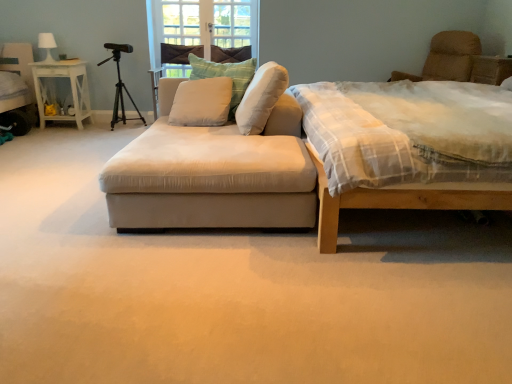
Question: Is white painted wood nightstand at left taller than beige fabric swivel chair at upper right?

Choices:
 (A) yes
 (B) no

Answer: (A)

Question: Can you confirm if white painted wood nightstand at left is bigger than beige fabric swivel chair at upper right?

Choices:
 (A) no
 (B) yes

Answer: (A)

Question: Considering the relative positions of white painted wood nightstand at left and beige fabric swivel chair at upper right in the image provided, is white painted wood nightstand at left to the right of beige fabric swivel chair at upper right from the viewer's perspective?

Choices:
 (A) yes
 (B) no

Answer: (B)

Question: Is white painted wood nightstand at left next to beige fabric swivel chair at upper right and touching it?

Choices:
 (A) no
 (B) yes

Answer: (A)

Question: Is white painted wood nightstand at left closer to the viewer compared to beige fabric swivel chair at upper right?

Choices:
 (A) yes
 (B) no

Answer: (B)

Question: Is white painted wood nightstand at left thinner than beige fabric swivel chair at upper right?

Choices:
 (A) yes
 (B) no

Answer: (A)

Question: Is light brown wooden bed at right bigger than white soft cushion at center, which is the first pillow from left to right?

Choices:
 (A) no
 (B) yes

Answer: (B)

Question: Considering the relative sizes of light brown wooden bed at right and white soft cushion at center, which is counted as the third pillow, starting from the right, in the image provided, is light brown wooden bed at right shorter than white soft cushion at center, which is counted as the third pillow, starting from the right,?

Choices:
 (A) yes
 (B) no

Answer: (B)

Question: Is light brown wooden bed at right turned away from white soft cushion at center, which is the first pillow from left to right?

Choices:
 (A) yes
 (B) no

Answer: (B)

Question: Is light brown wooden bed at right taller than white soft cushion at center, which is counted as the third pillow, starting from the right?

Choices:
 (A) no
 (B) yes

Answer: (B)

Question: From the image's perspective, is light brown wooden bed at right below white soft cushion at center, which is the first pillow from left to right?

Choices:
 (A) no
 (B) yes

Answer: (B)

Question: Is light brown wooden bed at right placed right next to white soft cushion at center, which is the first pillow from left to right?

Choices:
 (A) no
 (B) yes

Answer: (A)

Question: Does white painted wood nightstand at left touch black matte tripod at upper left?

Choices:
 (A) no
 (B) yes

Answer: (A)